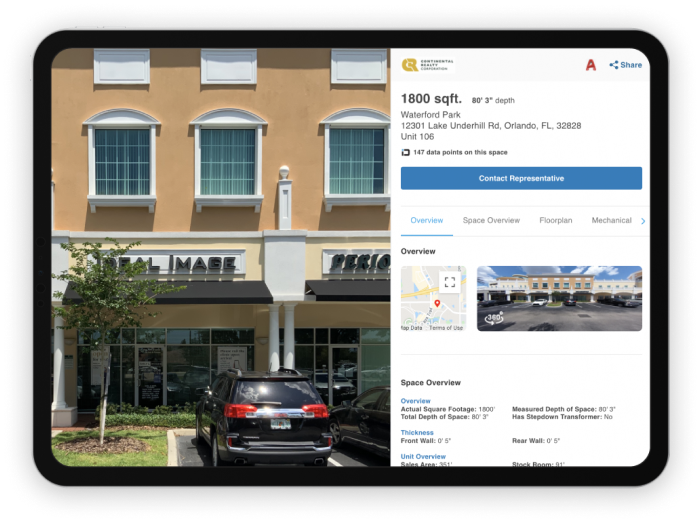
Locate an element on the screen. Image resolution: width=700 pixels, height=523 pixels. window is located at coordinates click(140, 167), click(237, 167), click(371, 157).